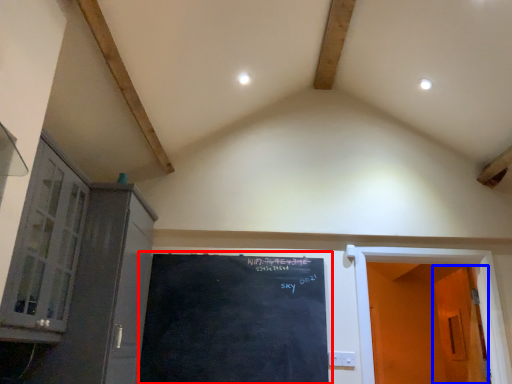
Question: Which object appears closest to the camera in this image, bulletin board (highlighted by a red box) or door (highlighted by a blue box)?

Choices:
 (A) bulletin board
 (B) door

Answer: (A)